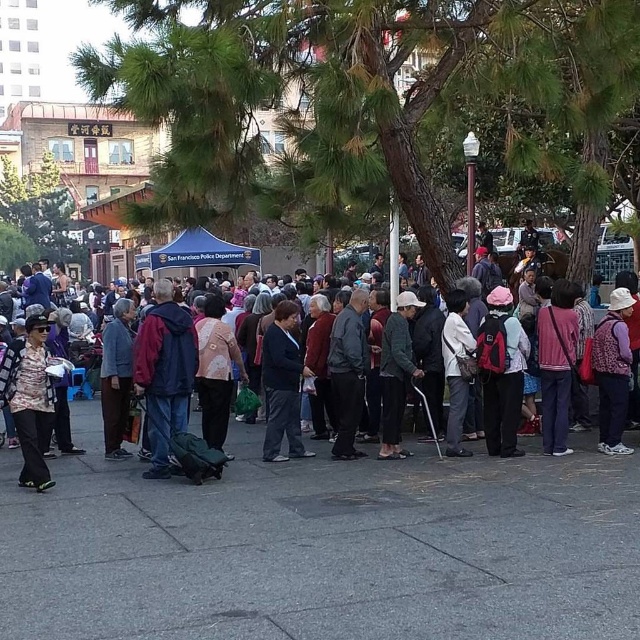
Question: Can you confirm if pink fabric backpack at center is positioned to the left of pink fabric jacket at center?

Choices:
 (A) yes
 (B) no

Answer: (A)

Question: Which point is closer to the camera?

Choices:
 (A) (118, 451)
 (B) (618, 326)
 (C) (340, 310)
 (D) (300, 481)

Answer: (D)

Question: Which of the following is the farthest from the observer?

Choices:
 (A) pink fabric backpack at center
 (B) dark blue jacket at center
 (C) green leafy tree at upper center
 (D) leather jacket at center

Answer: (C)

Question: Is green textured tree at upper center to the right of purple matte vest at center-right from the viewer's perspective?

Choices:
 (A) yes
 (B) no

Answer: (B)

Question: Which of these objects is positioned farthest from the green leafy tree at upper center?

Choices:
 (A) leather jacket at center
 (B) matte black jacket at center
 (C) matte pink sweater at center

Answer: (A)

Question: Is green textured tree at upper center thinner than patterned fabric jacket at lower left?

Choices:
 (A) no
 (B) yes

Answer: (A)